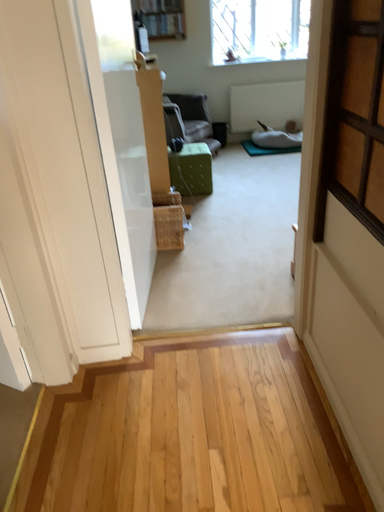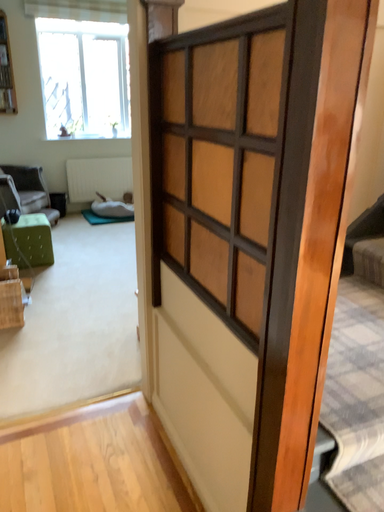
Question: Which way did the camera rotate in the video?

Choices:
 (A) rotated right
 (B) rotated left

Answer: (A)